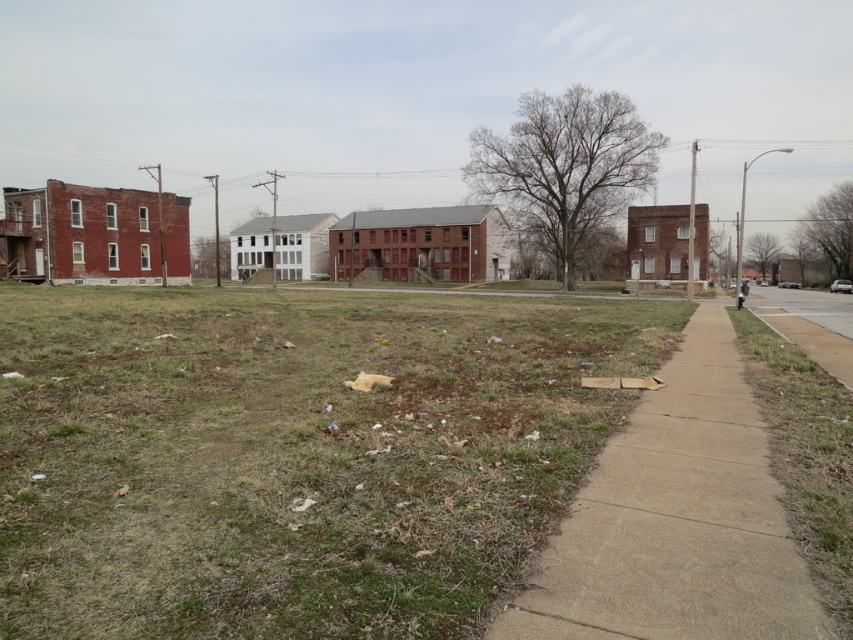
You are a drone operator trying to map the urban area. You need to identify the coordinates of the brown dry grass at lower left. What are its coordinates?

The coordinates of the brown dry grass at lower left are at point (x=292, y=454).

You are a gardener who needs to decide where to place a new garden bed. Given the brown dry grass at lower left and the concrete sidewalk at lower right, which area has more space for planting?

The brown dry grass at lower left has more space for planting because it is larger in size than the concrete sidewalk at lower right.

You are a gardener who needs to decide where to place a new rectangular garden bed. The garden bed is 2 meters wide. You see the brown dry grass at lower left and the concrete sidewalk at lower right. Which area can accommodate the garden bed based on their widths?

A: The brown dry grass at lower left might be wider than concrete sidewalk at lower right, so it can accommodate the garden bed since its width is likely sufficient.